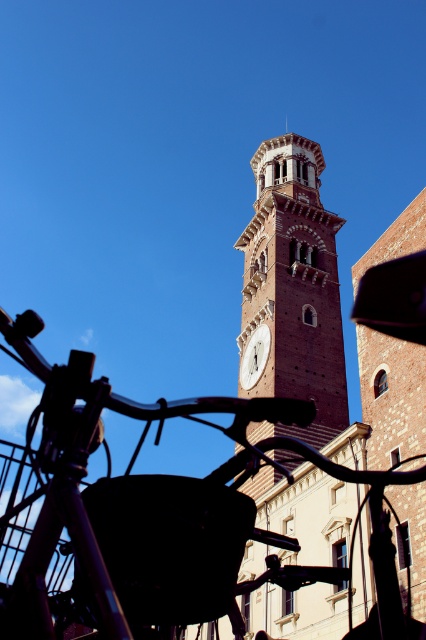
You are a photographer standing at the base of the clock tower. You want to take a photo that includes both the black matte bicycle at lower left and the white marble clock at center. Given that your camera has a maximum zoom range of 20 meters, can you capture both objects in the same frame without moving your position?

The black matte bicycle at lower left and white marble clock at center are 25.10 meters apart from each other. Since the camera can only zoom up to 20 meters, you cannot capture both objects in the same frame without moving your position.

You are standing in front of the brown brick clock tower at center. If you look directly ahead, will the clock face be visible?

The brown brick clock tower at center has its clock face located near the center of the tower, so looking directly ahead would allow you to see the clock face.

You are a tourist standing at the base of the historic clock tower. You see the black matte bicycle at lower left and the white marble clock at center. Which object is closer to you?

The black matte bicycle at lower left is closer to you because it is positioned under the white marble clock at center, placing it in the foreground.